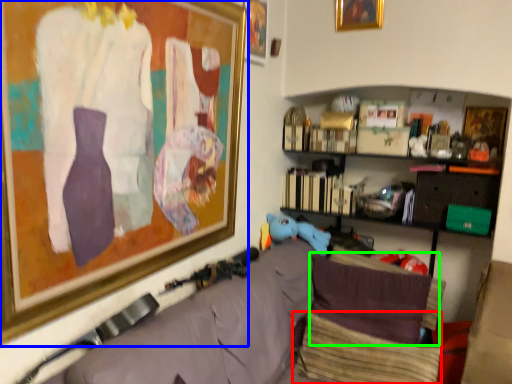
Question: Which object is the closest to the pillow (highlighted by a red box)? Choose among these: picture frame (highlighted by a blue box) or pillow (highlighted by a green box).

Choices:
 (A) picture frame
 (B) pillow

Answer: (B)